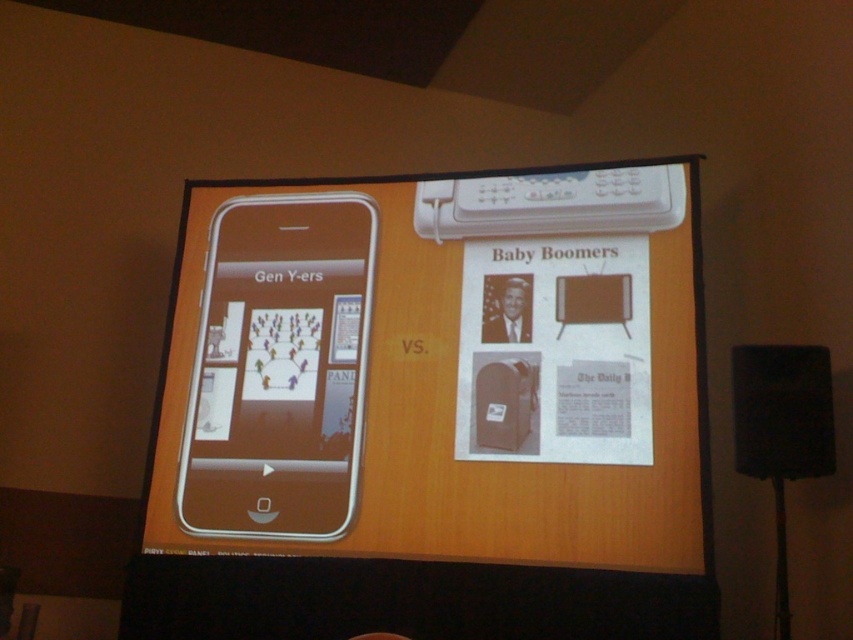
You are setting up a presentation and need to place a 12 inch wide laptop between the silver metallic phone at left and the black matte speaker at lower right. Can the laptop fit between them without overlapping either object?

The silver metallic phone at left and black matte speaker at lower right are 21.22 inches apart. Since the laptop is 12 inches wide, there is enough space between them to place the laptop without overlapping either object.

You are an attendee at the seminar and notice two points marked on the slide. The first point is at coordinates point (228, 291) and the second is at point (792, 426). Which point appears closer to you on the projected slide?

Point (228, 291) is further to the viewer than point (792, 426), so the first point is closer to you.